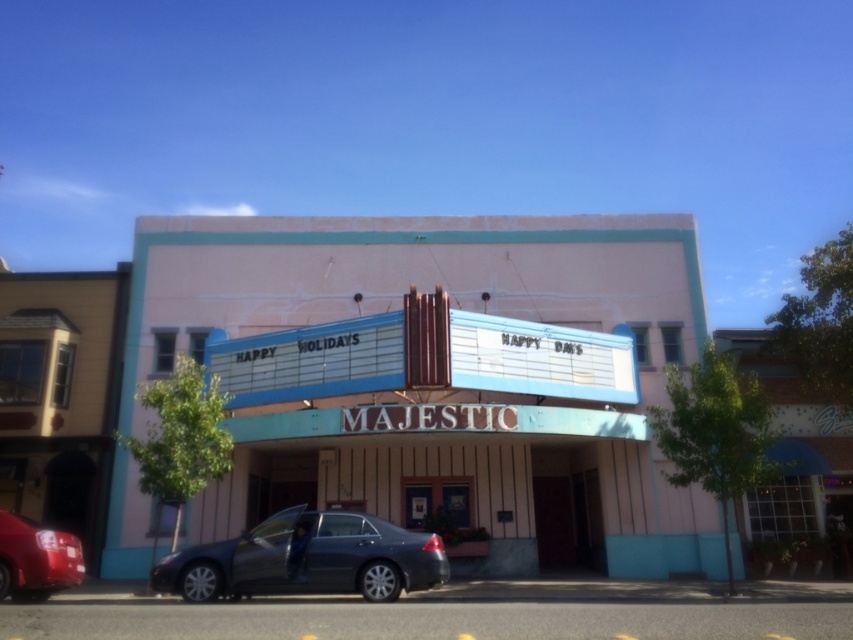
You are standing in front of the Majestic theater and want to take a photo of both the pink painted theater at center and the shiny black sedan at center. Which object should you focus on first to ensure both are in the frame?

You should focus on the pink painted theater at center first because it is closer to you than the shiny black sedan at center, so adjusting the camera to include both would require ensuring the closer object is framed properly first.

You are driving a shiny red sedan at lower left and want to park it in a parking spot that is exactly the same width as the pink painted theater at center. Is the parking spot wide enough for your car?

The pink painted theater at center might be wider than shiny red sedan at lower left, so the parking spot might be wide enough for the shiny red sedan at lower left.

You are a photographer standing in front of the Majestic theater. You want to take a photo that includes both the pink painted theater at center and the shiny black sedan at center. Which object should appear larger in the photo?

The pink painted theater at center should appear larger in the photo because it is taller than the shiny black sedan at center.